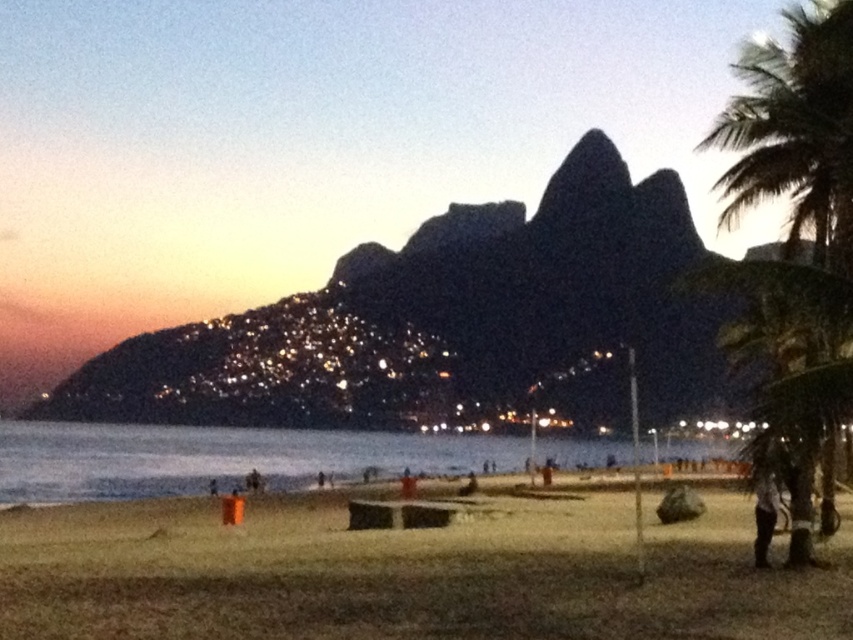
Question: Does brown sand at lower center have a smaller size compared to green leafy palm tree at right?

Choices:
 (A) no
 (B) yes

Answer: (A)

Question: Is green leafy palm tree at right thinner than dark gray fabric pants at lower right?

Choices:
 (A) no
 (B) yes

Answer: (A)

Question: Is brown sand at lower center further to camera compared to camouflage fabric pants at lower right?

Choices:
 (A) yes
 (B) no

Answer: (B)

Question: Considering the real-world distances, which object is farthest from the brown sand at lower center?

Choices:
 (A) camouflage fabric pants at lower right
 (B) green leafy palm tree at right

Answer: (B)

Question: Which point is farther from the camera taking this photo?

Choices:
 (A) (757, 512)
 (B) (637, 620)
 (C) (834, 426)

Answer: (A)

Question: Which point is closer to the camera?

Choices:
 (A) dark gray fabric pants at lower right
 (B) brown sand at lower center
 (C) camouflage fabric pants at lower right
 (D) green leafy palm tree at right

Answer: (B)